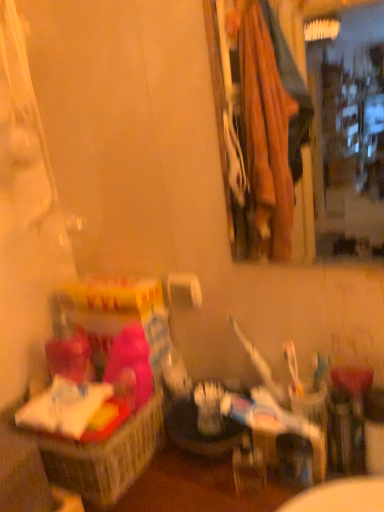
Question: Considering the positions of pink fabric basket at left and white matte toilet paper at center in the image, is pink fabric basket at left taller or shorter than white matte toilet paper at center?

Choices:
 (A) short
 (B) tall

Answer: (B)

Question: Considering the positions of point (117, 483) and point (183, 281), is point (117, 483) closer or farther from the camera than point (183, 281)?

Choices:
 (A) farther
 (B) closer

Answer: (B)

Question: Estimate the real-world distances between objects in this image. Which object is closer to the white matte toilet paper at center?

Choices:
 (A) pink fabric basket at left
 (B) wooden frame mirror at upper right

Answer: (A)

Question: Which object is the farthest from the wooden frame mirror at upper right?

Choices:
 (A) white matte toilet paper at center
 (B) pink fabric basket at left

Answer: (B)